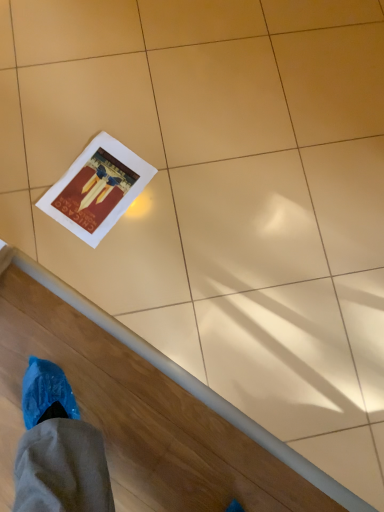
This screenshot has height=512, width=384. What do you see at coordinates (136, 417) in the screenshot?
I see `white plastic ledge at lower left` at bounding box center [136, 417].

Locate an element on the screen. The width and height of the screenshot is (384, 512). white plastic ledge at lower left is located at coordinates (136, 417).

Measure the distance between point (264, 452) and camera.

The distance of point (264, 452) from camera is 1.10 meters.

What is the approximate height of white plastic ledge at lower left?

1.57 inches.

This screenshot has width=384, height=512. I want to click on white plastic ledge at lower left, so coord(136,417).